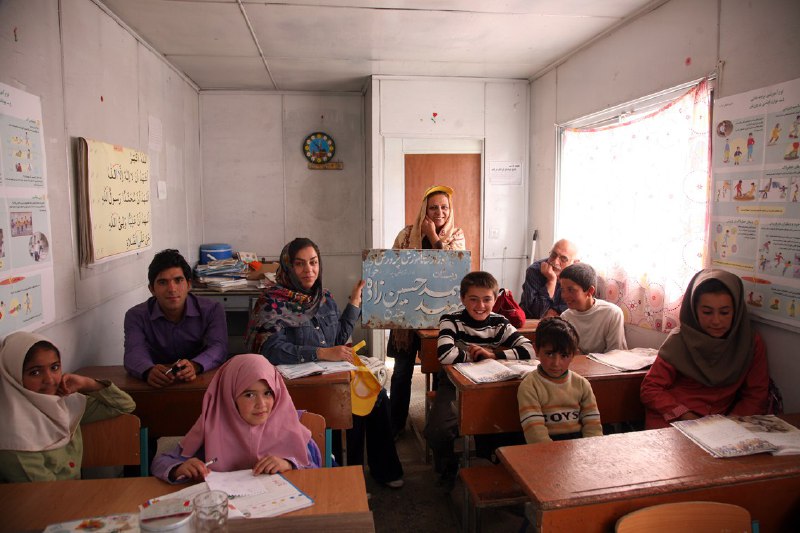
I want to click on chairs, so click(x=670, y=516), click(x=314, y=421), click(x=114, y=434).